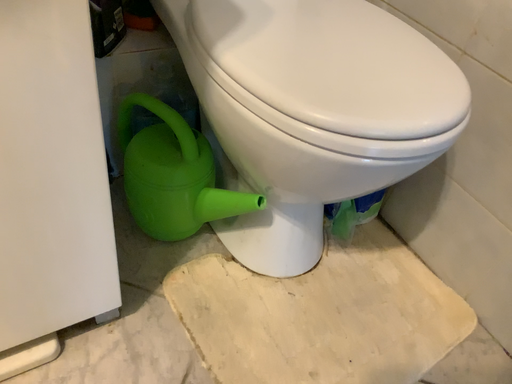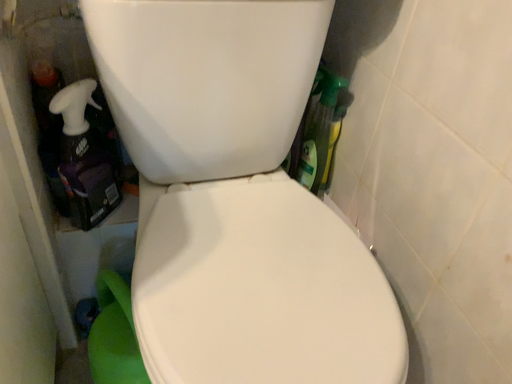
Question: Which way did the camera rotate in the video?

Choices:
 (A) rotated right
 (B) rotated left

Answer: (B)